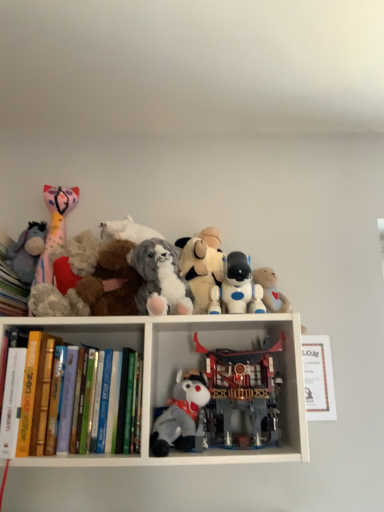
Question: Is white paper at upper center, positioned as the 1th paperback book in right-to-left order, to the left of plush purple at left, which is the 1th toy from left to right, from the viewer's perspective?

Choices:
 (A) yes
 (B) no

Answer: (B)

Question: Does white paper at upper center, positioned as the 1th paperback book in right-to-left order, have a larger size compared to plush purple at left, which is the 1th toy from left to right?

Choices:
 (A) yes
 (B) no

Answer: (B)

Question: Are white paper at upper center, positioned as the 3th paperback book in left-to-right order, and plush purple at left, which is the 1th toy from left to right, far apart?

Choices:
 (A) yes
 (B) no

Answer: (B)

Question: Is white paper at upper center, positioned as the 3th paperback book in left-to-right order, positioned beyond the bounds of plush purple at left, acting as the eighth toy starting from the right?

Choices:
 (A) no
 (B) yes

Answer: (B)

Question: Is white paper at upper center, positioned as the 1th paperback book in right-to-left order, at the right side of plush purple at left, which is the 1th toy from left to right?

Choices:
 (A) no
 (B) yes

Answer: (B)

Question: Could you tell me if white paper at upper center, positioned as the 1th paperback book in right-to-left order, is turned towards plush purple at left, which is the 1th toy from left to right?

Choices:
 (A) no
 (B) yes

Answer: (A)

Question: Is hardcover book at left, arranged as the first paperback book when viewed from the left, located within fluffy pink and white plush toy at left, the 7th toy in the right-to-left sequence?

Choices:
 (A) yes
 (B) no

Answer: (B)

Question: Does fluffy pink and white plush toy at left, arranged as the 2th toy when viewed from the left, have a smaller size compared to hardcover book at left, the 3th paperback book in the right-to-left sequence?

Choices:
 (A) no
 (B) yes

Answer: (A)

Question: Is fluffy pink and white plush toy at left, the 7th toy in the right-to-left sequence, at the left side of hardcover book at left, arranged as the first paperback book when viewed from the left?

Choices:
 (A) no
 (B) yes

Answer: (B)

Question: Is fluffy pink and white plush toy at left, arranged as the 2th toy when viewed from the left, shorter than hardcover book at left, arranged as the first paperback book when viewed from the left?

Choices:
 (A) no
 (B) yes

Answer: (A)

Question: From the image's perspective, is fluffy pink and white plush toy at left, the 7th toy in the right-to-left sequence, beneath hardcover book at left, arranged as the first paperback book when viewed from the left?

Choices:
 (A) no
 (B) yes

Answer: (A)

Question: Is fluffy pink and white plush toy at left, arranged as the 2th toy when viewed from the left, thinner than hardcover book at left, arranged as the first paperback book when viewed from the left?

Choices:
 (A) yes
 (B) no

Answer: (A)

Question: Is fluffy gray plush at center, placed as the fifth toy when sorted from right to left, looking in the opposite direction of fluffy pink and white plush toy at left, the 7th toy in the right-to-left sequence?

Choices:
 (A) yes
 (B) no

Answer: (B)